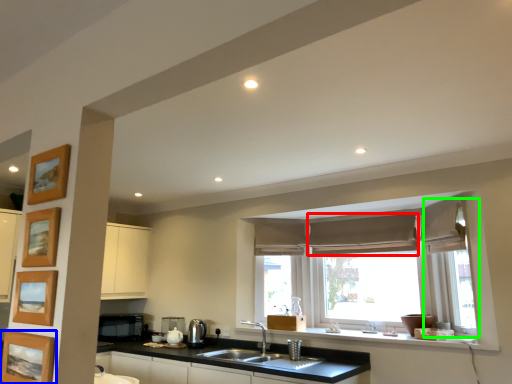
Question: Which object is positioned closest to curtain (highlighted by a red box)? Select from picture frame (highlighted by a blue box) and window frame (highlighted by a green box).

Choices:
 (A) picture frame
 (B) window frame

Answer: (B)